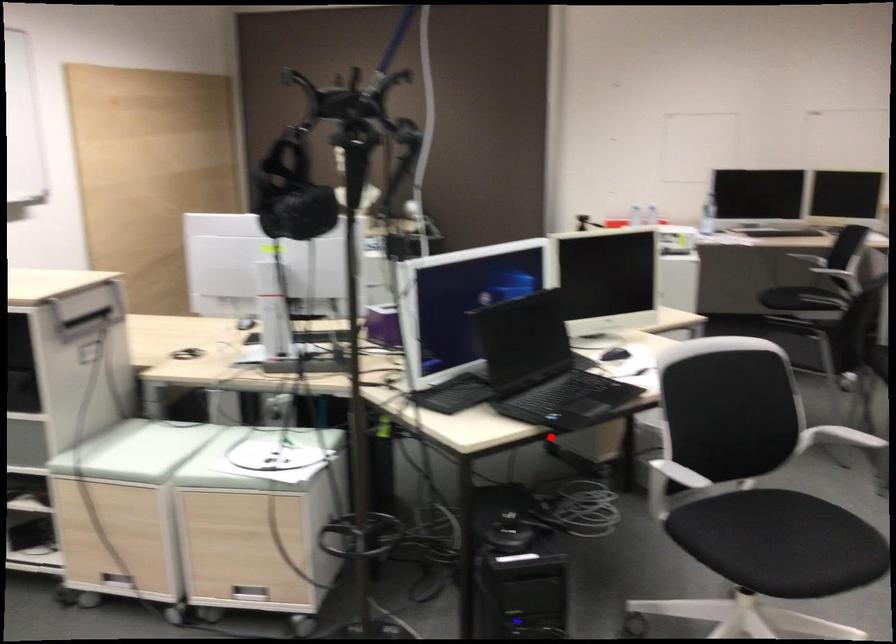
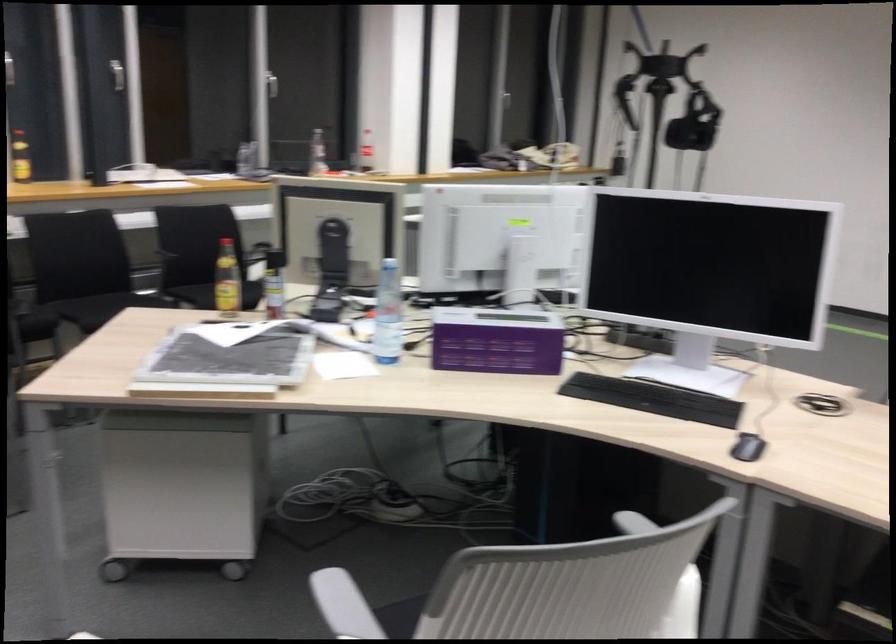
Question: I am providing you with two images of the same scene from different viewpoints. Image1 has a red point marked. In image2, the corresponding 3D location appears at what relative position? Reply with the corresponding letter.

Choices:
 (A) Closer
 (B) Farther

Answer: (A)